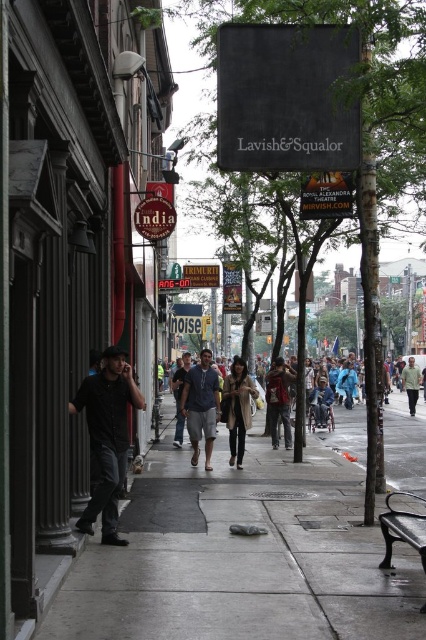
You are a pedestrian walking down the street and see the black fabric sign at upper center and the black matte shirt at left. Which object is closer to you?

The black fabric sign at upper center is closer to you because the black matte shirt at left is behind it.

You are a pedestrian standing on the sidewalk looking down the street. You see a black fabric sign at upper center and denim shorts at center. Which object is higher up in the scene?

The black fabric sign at upper center is located above denim shorts at center, so it is higher up in the scene.

You are a pedestrian standing on the sidewalk looking down the street. You notice a black fabric sign at upper center and denim shorts at center. Which object is closer to you?

The black fabric sign at upper center is closer to you because it is in front of the denim shorts at center.